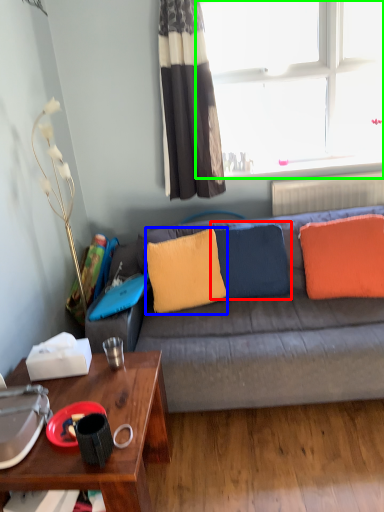
Question: Which is nearer to the pillow (highlighted by a red box)? pillow (highlighted by a blue box) or window (highlighted by a green box).

Choices:
 (A) pillow
 (B) window

Answer: (A)